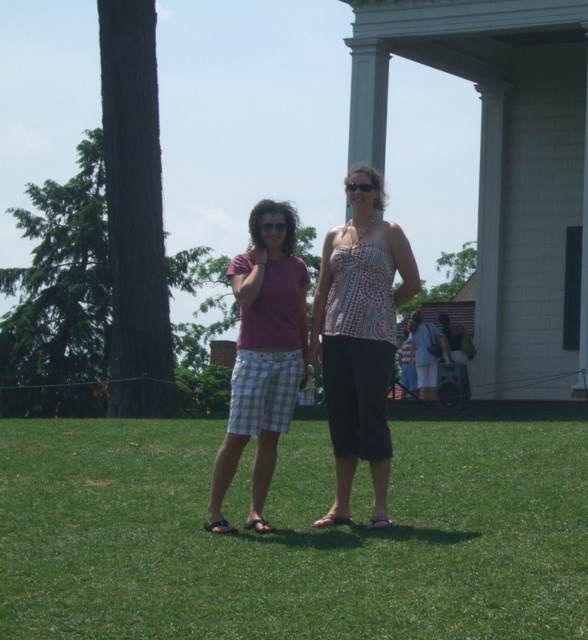
Question: Does green grass at center have a greater width compared to printed fabric top at center?

Choices:
 (A) yes
 (B) no

Answer: (A)

Question: Which point is farther to the camera?

Choices:
 (A) (355, 513)
 (B) (382, 516)

Answer: (A)

Question: Is green grass at center wider than plaid shorts at center?

Choices:
 (A) no
 (B) yes

Answer: (B)

Question: Estimate the real-world distances between objects in this image. Which object is closer to the green grass at center?

Choices:
 (A) plaid shorts at center
 (B) printed fabric top at center

Answer: (A)

Question: Which object is closer to the camera taking this photo?

Choices:
 (A) printed fabric top at center
 (B) green grass at center
 (C) plaid shorts at center

Answer: (B)

Question: Is green grass at center positioned at the back of printed fabric top at center?

Choices:
 (A) yes
 (B) no

Answer: (B)